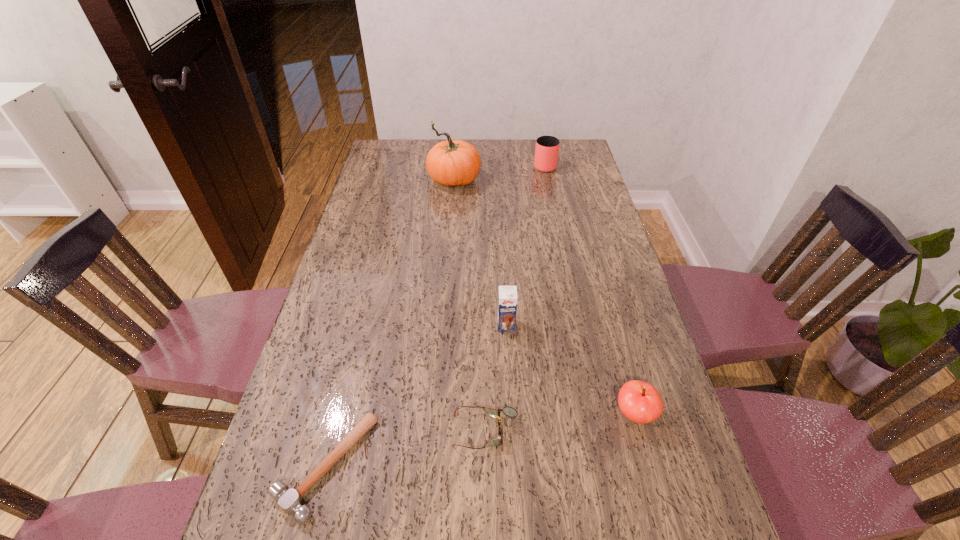
This screenshot has height=540, width=960. Identify the location of vacant space located 0.150m on the handle side of the cup. (540, 140).

This screenshot has height=540, width=960. In order to click on free space located on the handle side of the cup in this screenshot , I will do `click(540, 146)`.

At what (x,y) coordinates should I click in order to perform the action: click on free spot located on the left of the fourth tallest object. Please return your answer as a coordinate pair (x, y). Looking at the image, I should click on (470, 414).

What are the coordinates of `vacant area situated on the front-facing side of the spectacles` in the screenshot? It's located at (381, 431).

Where is `free space located 0.210m on the front-facing side of the spectacles`? free space located 0.210m on the front-facing side of the spectacles is located at coordinates coord(358,431).

This screenshot has width=960, height=540. Identify the location of vacant position located on the front-facing side of the spectacles. (412, 431).

Image resolution: width=960 pixels, height=540 pixels. What are the coordinates of `free location located 0.390m on the back of the leftmost object` in the screenshot? It's located at (370, 293).

This screenshot has height=540, width=960. I want to click on object present at the far edge, so click(547, 147).

Locate an element on the screen. The image size is (960, 540). object at the left edge is located at coordinates (290, 500).

This screenshot has height=540, width=960. In order to click on cup that is at the right edge in this screenshot , I will do `click(547, 147)`.